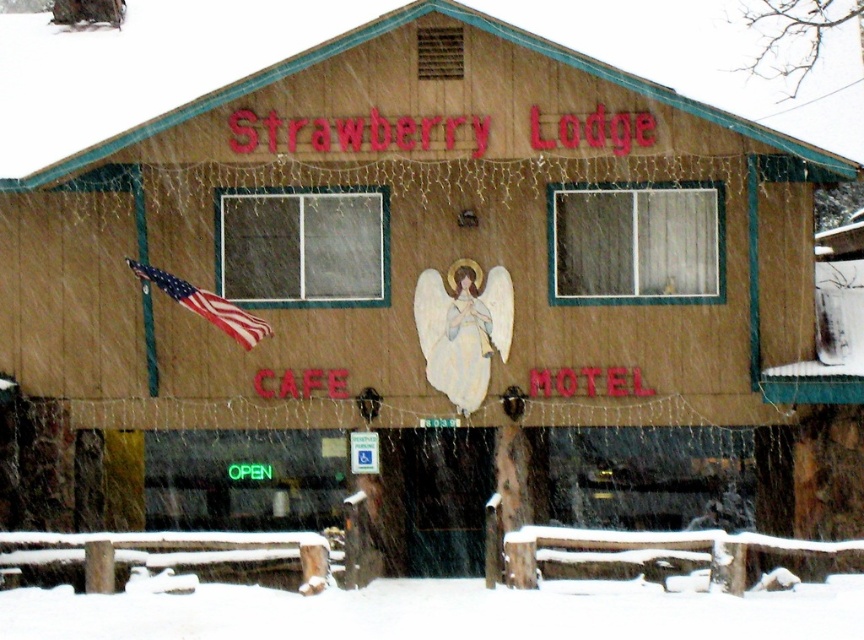
Question: Which object is the closest to the american flag at left?

Choices:
 (A) pastel blue fabric angel at center
 (B) white fluffy snow at lower center

Answer: (A)

Question: Can you confirm if pastel blue fabric angel at center is positioned to the right of american flag at left?

Choices:
 (A) yes
 (B) no

Answer: (A)

Question: Can you confirm if white fluffy snow at lower center is positioned below american flag at left?

Choices:
 (A) yes
 (B) no

Answer: (A)

Question: Which point appears farthest from the camera in this image?

Choices:
 (A) (253, 339)
 (B) (473, 392)
 (C) (221, 612)

Answer: (B)

Question: Which object is closer to the camera taking this photo?

Choices:
 (A) american flag at left
 (B) white fluffy snow at lower center

Answer: (B)

Question: Can you confirm if white fluffy snow at lower center is positioned below american flag at left?

Choices:
 (A) no
 (B) yes

Answer: (B)